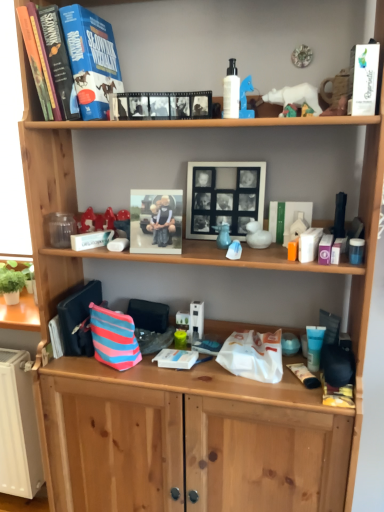
Locate an element on the screen. This screenshot has width=384, height=512. black matte picture frame at center, the 2th picture frame viewed from the left is located at coordinates (224, 197).

Describe the element at coordinates (231, 91) in the screenshot. I see `white glossy lotion at upper center, which appears as the first toiletry when viewed from the left` at that location.

What do you see at coordinates (156, 221) in the screenshot?
I see `matte plastic photo frame at center, which appears as the 1th picture frame when viewed from the left` at bounding box center [156, 221].

Where is `hardcover book at upper left, which is the first paperback book from back to front`? This screenshot has width=384, height=512. hardcover book at upper left, which is the first paperback book from back to front is located at coordinates (91, 60).

What do you see at coordinates (363, 78) in the screenshot? I see `white paper at upper right, which ranks as the 2th paperback book in back-to-front order` at bounding box center [363, 78].

Image resolution: width=384 pixels, height=512 pixels. What do you see at coordinates (325, 249) in the screenshot?
I see `matte plastic container at middle right, the second toiletry in the front-to-back sequence` at bounding box center [325, 249].

What do you see at coordinates (314, 346) in the screenshot? The image size is (384, 512). I see `blue translucent tube at lower right, placed as the 1th toiletry when sorted from back to front` at bounding box center [314, 346].

The width and height of the screenshot is (384, 512). In order to click on black matte picture frame at center, which is the 1th picture frame in right-to-left order in this screenshot , I will do `click(224, 197)`.

Which object is closer to the camera, striped fabric pouch at lower center or black matte film strip at upper center, arranged as the 2th book when viewed from the back?

black matte film strip at upper center, arranged as the 2th book when viewed from the back, is closer to the camera.

Is striped fabric pouch at lower center positioned beyond the bounds of black matte film strip at upper center, which appears as the first book when viewed from the top?

Yes, striped fabric pouch at lower center is located beyond the bounds of black matte film strip at upper center, which appears as the first book when viewed from the top.

Can you confirm if striped fabric pouch at lower center is smaller than black matte film strip at upper center, which appears as the first book when viewed from the top?

No, striped fabric pouch at lower center is not smaller than black matte film strip at upper center, which appears as the first book when viewed from the top.

Can you see striped fabric pouch at lower center touching black matte film strip at upper center, which appears as the first book when viewed from the top?

No, striped fabric pouch at lower center is not beside black matte film strip at upper center, which appears as the first book when viewed from the top.

In the scene shown: Choose the correct answer: Is matte plastic container at middle right, which is the second toiletry from bottom to top, inside white glossy lotion at upper center, which appears as the first toiletry when viewed from the left, or outside it?

The correct answer is: outside.

From the image's perspective, is matte plastic container at middle right, the second toiletry in the front-to-back sequence, located above white glossy lotion at upper center, which is counted as the third toiletry, starting from the bottom?

Incorrect, from the image's perspective, matte plastic container at middle right, the second toiletry in the front-to-back sequence, is lower than white glossy lotion at upper center, which is counted as the third toiletry, starting from the bottom.

Considering the positions of objects matte plastic container at middle right, which is the second toiletry from bottom to top, and white glossy lotion at upper center, which is counted as the first toiletry, starting from the top, in the image provided, who is in front, matte plastic container at middle right, which is the second toiletry from bottom to top, or white glossy lotion at upper center, which is counted as the first toiletry, starting from the top,?

white glossy lotion at upper center, which is counted as the first toiletry, starting from the top, is more forward.

Are matte plastic container at middle right, which is the second toiletry from bottom to top, and white glossy lotion at upper center, which appears as the first toiletry when viewed from the left, located far from each other?

Actually, matte plastic container at middle right, which is the second toiletry from bottom to top, and white glossy lotion at upper center, which appears as the first toiletry when viewed from the left, are a little close together.

Is black matte picture frame at center, which is the 1th picture frame in right-to-left order, looking in the opposite direction of white paper at upper right, the first paperback book when ordered from right to left?

That's not correct — black matte picture frame at center, which is the 1th picture frame in right-to-left order, is not looking away from white paper at upper right, the first paperback book when ordered from right to left.

Considering the sizes of objects black matte picture frame at center, the 2th picture frame viewed from the left, and white paper at upper right, which appears as the 1th paperback book when viewed from the front, in the image provided, who is taller, black matte picture frame at center, the 2th picture frame viewed from the left, or white paper at upper right, which appears as the 1th paperback book when viewed from the front,?

Standing taller between the two is black matte picture frame at center, the 2th picture frame viewed from the left.

From the picture: Choose the correct answer: Is black matte picture frame at center, which is the 1th picture frame in right-to-left order, inside white paper at upper right, which appears as the 1th paperback book when viewed from the front, or outside it?

black matte picture frame at center, which is the 1th picture frame in right-to-left order, lies outside white paper at upper right, which appears as the 1th paperback book when viewed from the front.

Looking at this image, from the image's perspective, which one is positioned lower, black matte picture frame at center, the 2th picture frame viewed from the left, or hardcover book at upper left, positioned as the second paperback book in front-to-back order?

black matte picture frame at center, the 2th picture frame viewed from the left, appears lower in the image.

Which object is positioned more to the right, black matte picture frame at center, the 2th picture frame viewed from the left, or hardcover book at upper left, positioned as the 1th paperback book in left-to-right order?

Positioned to the right is black matte picture frame at center, the 2th picture frame viewed from the left.

From the picture: Can you confirm if black matte picture frame at center, the 2th picture frame viewed from the left, is bigger than hardcover book at upper left, the second paperback book positioned from the right?

Incorrect, black matte picture frame at center, the 2th picture frame viewed from the left, is not larger than hardcover book at upper left, the second paperback book positioned from the right.

Considering the sizes of white paper at upper right, acting as the 2th paperback book starting from the left, and matte plastic photo frame at center, which appears as the 1th picture frame when viewed from the left, in the image, is white paper at upper right, acting as the 2th paperback book starting from the left, wider or thinner than matte plastic photo frame at center, which appears as the 1th picture frame when viewed from the left,?

white paper at upper right, acting as the 2th paperback book starting from the left, is thinner than matte plastic photo frame at center, which appears as the 1th picture frame when viewed from the left.

From the image's perspective, is white paper at upper right, which appears as the 1th paperback book when viewed from the front, beneath matte plastic photo frame at center, arranged as the second picture frame when viewed from the right?

Incorrect, from the image's perspective, white paper at upper right, which appears as the 1th paperback book when viewed from the front, is higher than matte plastic photo frame at center, arranged as the second picture frame when viewed from the right.

Considering the relative sizes of white paper at upper right, which ranks as the 2th paperback book in back-to-front order, and matte plastic photo frame at center, which appears as the 1th picture frame when viewed from the left, in the image provided, is white paper at upper right, which ranks as the 2th paperback book in back-to-front order, taller than matte plastic photo frame at center, which appears as the 1th picture frame when viewed from the left,?

Incorrect, the height of white paper at upper right, which ranks as the 2th paperback book in back-to-front order, is not larger of that of matte plastic photo frame at center, which appears as the 1th picture frame when viewed from the left.

From a real-world perspective, which is physically above, white paper at upper right, the first paperback book when ordered from right to left, or matte plastic photo frame at center, which appears as the 1th picture frame when viewed from the left?

white paper at upper right, the first paperback book when ordered from right to left.

In the scene shown: Can we say matte plastic container at middle right, which is the 2th toiletry from top to bottom, lies outside black matte picture frame at center, the 2th picture frame viewed from the left?

That's correct, matte plastic container at middle right, which is the 2th toiletry from top to bottom, is outside of black matte picture frame at center, the 2th picture frame viewed from the left.

Is point (329, 234) less distant than point (208, 182)?

Yes, it is.

From the image's perspective, which is below, matte plastic container at middle right, the second toiletry in the front-to-back sequence, or black matte picture frame at center, which is the 1th picture frame in right-to-left order?

matte plastic container at middle right, the second toiletry in the front-to-back sequence, from the image's perspective.

How much distance is there between matte plastic container at middle right, which is the second toiletry from bottom to top, and black matte picture frame at center, which is the 1th picture frame in right-to-left order?

A distance of 13.52 inches exists between matte plastic container at middle right, which is the second toiletry from bottom to top, and black matte picture frame at center, which is the 1th picture frame in right-to-left order.

There is a white paper at upper right, acting as the 2th paperback book starting from the left. Where is `the 1st toiletry below it (from a real-world perspective)`? This screenshot has height=512, width=384. the 1st toiletry below it (from a real-world perspective) is located at coordinates (231, 91).

From the image's perspective, is white paper at upper right, acting as the 2th paperback book starting from the left, on white glossy lotion at upper center, which is the third toiletry in back-to-front order?

No, from the image's perspective, white paper at upper right, acting as the 2th paperback book starting from the left, is not above white glossy lotion at upper center, which is the third toiletry in back-to-front order.

Does white paper at upper right, acting as the 2th paperback book starting from the left, turn towards white glossy lotion at upper center, which is counted as the first toiletry, starting from the top?

No, white paper at upper right, acting as the 2th paperback book starting from the left, is not aimed at white glossy lotion at upper center, which is counted as the first toiletry, starting from the top.

At what (x,y) coordinates should I click in order to perform the action: click on shopping bag that appears behind the black matte film strip at upper center, which is the second book in right-to-left order. Please return your answer as a coordinate pair (x, y). This screenshot has width=384, height=512. Looking at the image, I should click on [x=113, y=338].

This screenshot has height=512, width=384. I want to click on the 1st toiletry below the white glossy lotion at upper center, which is counted as the third toiletry, starting from the bottom (from a real-world perspective), so click(325, 249).

Which object lies further to the anchor point black matte picture frame at center, the 2th picture frame viewed from the left, matte plastic photo frame at center, which appears as the 1th picture frame when viewed from the left, or white glossy lotion at upper center, which appears as the first toiletry when viewed from the left?

Among the two, white glossy lotion at upper center, which appears as the first toiletry when viewed from the left, is located further to black matte picture frame at center, the 2th picture frame viewed from the left.

Estimate the real-world distances between objects in this image. Which object is further from white glossy lotion at upper center, the third toiletry viewed from the right, blue translucent tube at lower right, arranged as the first toiletry when viewed from the right, or black matte film strip at upper center, which is the second book in right-to-left order?

blue translucent tube at lower right, arranged as the first toiletry when viewed from the right, is further to white glossy lotion at upper center, the third toiletry viewed from the right.

From the image, which object appears to be farther from matte plastic container at middle right, which is the second toiletry from bottom to top, blue translucent tube at lower right, arranged as the first toiletry when viewed from the right, or hardcover book at upper left, the second paperback book positioned from the right?

Among the two, hardcover book at upper left, the second paperback book positioned from the right, is located further to matte plastic container at middle right, which is the second toiletry from bottom to top.

From the image, which object appears to be farther from white glossy lotion at upper center, which is counted as the third toiletry, starting from the bottom, hardcover book at upper left, which is the first paperback book from back to front, or matte plastic container at middle right, which is the second toiletry from bottom to top?

matte plastic container at middle right, which is the second toiletry from bottom to top, lies further to white glossy lotion at upper center, which is counted as the third toiletry, starting from the bottom, than the other object.

Looking at the image, which one is located further to green matte book at center-right, arranged as the second book when viewed from the top, matte plastic photo frame at center, arranged as the second picture frame when viewed from the right, or matte plastic container at middle right, the 2th toiletry in the left-to-right sequence?

Among the two, matte plastic photo frame at center, arranged as the second picture frame when viewed from the right, is located further to green matte book at center-right, arranged as the second book when viewed from the top.

Looking at the image, which one is located further to blue translucent tube at lower right, placed as the 1th toiletry when sorted from back to front, black matte film strip at upper center, positioned as the second book in bottom-to-top order, or white paper at upper right, which appears as the 1th paperback book when viewed from the front?

black matte film strip at upper center, positioned as the second book in bottom-to-top order.

Based on their spatial positions, is matte plastic photo frame at center, arranged as the second picture frame when viewed from the right, or striped fabric pouch at lower center further from white paper at upper right, acting as the 2th paperback book starting from the left?

striped fabric pouch at lower center is positioned further to the anchor white paper at upper right, acting as the 2th paperback book starting from the left.

In the scene shown: Estimate the real-world distances between objects in this image. Which object is closer to matte plastic photo frame at center, arranged as the second picture frame when viewed from the right, green matte book at center-right, the first book in the back-to-front sequence, or white glossy lotion at upper center, which is counted as the third toiletry, starting from the bottom?

Among the two, white glossy lotion at upper center, which is counted as the third toiletry, starting from the bottom, is located nearer to matte plastic photo frame at center, arranged as the second picture frame when viewed from the right.

Where is `paperback book between white glossy lotion at upper center, which is counted as the first toiletry, starting from the top, and blue translucent tube at lower right, marked as the third toiletry in a front-to-back arrangement, in the vertical direction`? The height and width of the screenshot is (512, 384). paperback book between white glossy lotion at upper center, which is counted as the first toiletry, starting from the top, and blue translucent tube at lower right, marked as the third toiletry in a front-to-back arrangement, in the vertical direction is located at coordinates (363, 78).

Find the location of `toiletry between white glossy lotion at upper center, which is counted as the first toiletry, starting from the top, and striped fabric pouch at lower center, in the vertical direction`. toiletry between white glossy lotion at upper center, which is counted as the first toiletry, starting from the top, and striped fabric pouch at lower center, in the vertical direction is located at coordinates (325, 249).

At what (x,y) coordinates should I click in order to perform the action: click on picture frame between black matte picture frame at center, which is the 1th picture frame in right-to-left order, and striped fabric pouch at lower center in the up-down direction. Please return your answer as a coordinate pair (x, y). The height and width of the screenshot is (512, 384). Looking at the image, I should click on (156, 221).

Locate an element on the screen. book between black matte picture frame at center, the 2th picture frame viewed from the left, and blue translucent tube at lower right, which is counted as the first toiletry, starting from the bottom, in the up-down direction is located at coordinates pos(287,218).